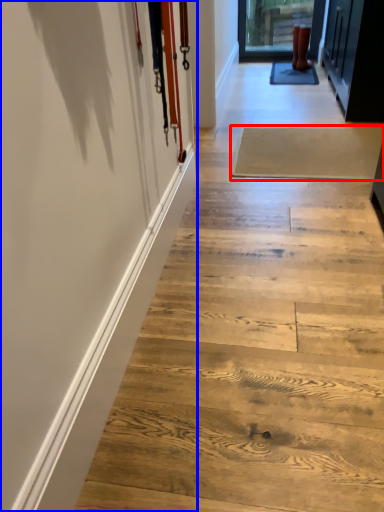
Question: Among these objects, which one is nearest to the camera, plank (highlighted by a red box) or barn door (highlighted by a blue box)?

Choices:
 (A) plank
 (B) barn door

Answer: (B)